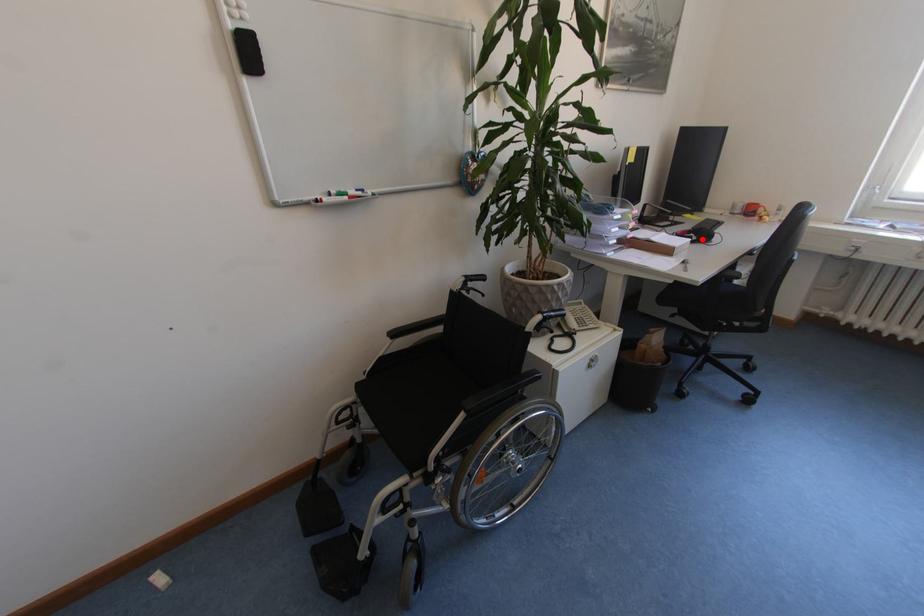
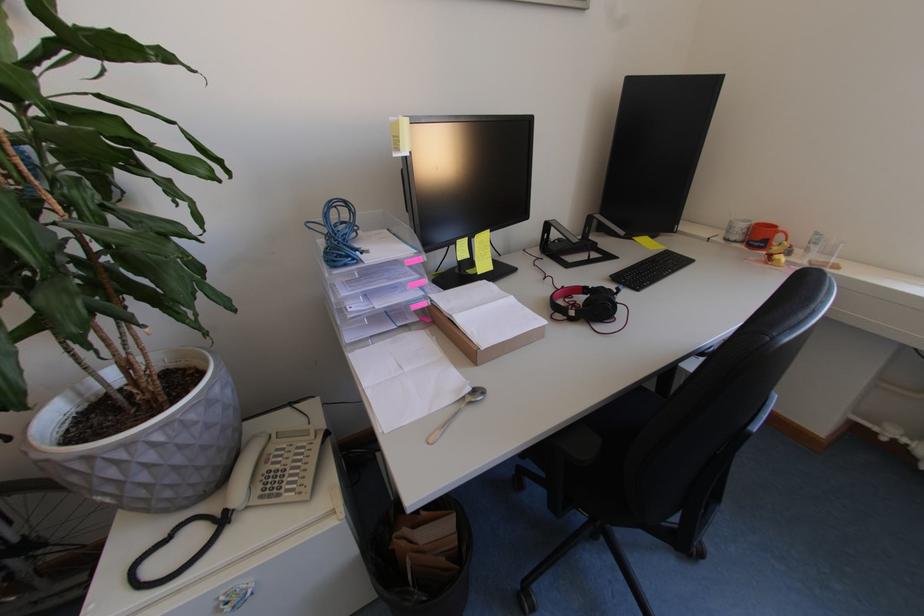
Where in the second image is the point corresponding to the highlighted location from the first image?

(579, 314)